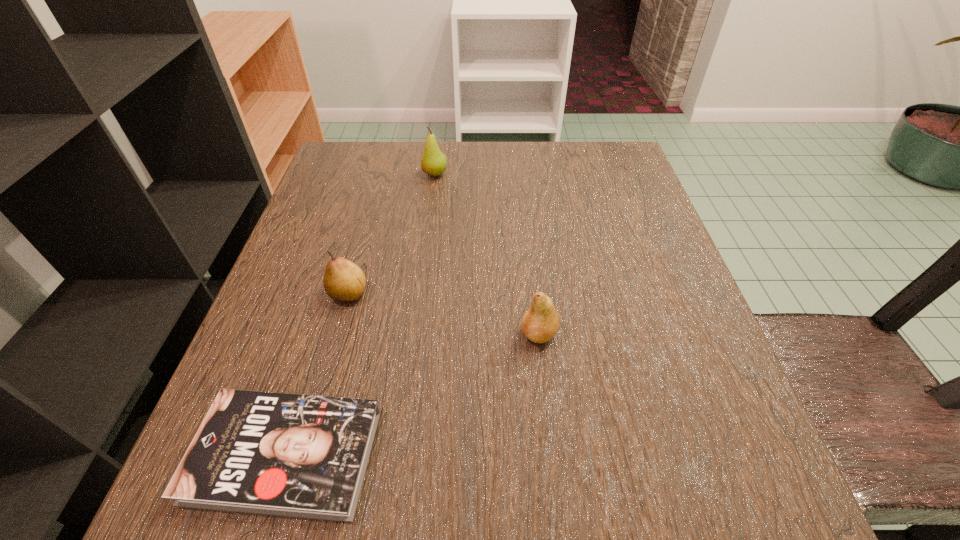
At what (x,y) coordinates should I click in order to perform the action: click on the farthest object. Please return your answer as a coordinate pair (x, y). The image size is (960, 540). Looking at the image, I should click on (433, 162).

You are a GUI agent. You are given a task and a screenshot of the screen. Output one action in this format:
    pyautogui.click(x=<x>, y=<y>)
    Task: Click on the second pear from left to right
    The width and height of the screenshot is (960, 540).
    Given the screenshot: What is the action you would take?
    pyautogui.click(x=433, y=162)

Image resolution: width=960 pixels, height=540 pixels. Identify the location of the rightmost object. (540, 322).

The width and height of the screenshot is (960, 540). In order to click on the rightmost pear in this screenshot , I will do `click(540, 322)`.

Find the location of `the third tallest object`. the third tallest object is located at coordinates (344, 281).

Find the location of a particular element. The width and height of the screenshot is (960, 540). the shortest pear is located at coordinates (344, 281).

At what (x,y) coordinates should I click in order to perform the action: click on book. Please return your answer as a coordinate pair (x, y). This screenshot has width=960, height=540. Looking at the image, I should click on (293, 455).

The width and height of the screenshot is (960, 540). What are the coordinates of `the shortest object` in the screenshot? It's located at (293, 455).

In order to click on blank space located on the right of the farthest pear in this screenshot , I will do `click(610, 174)`.

Identify the location of free space located on the back of the second nearest object. (533, 284).